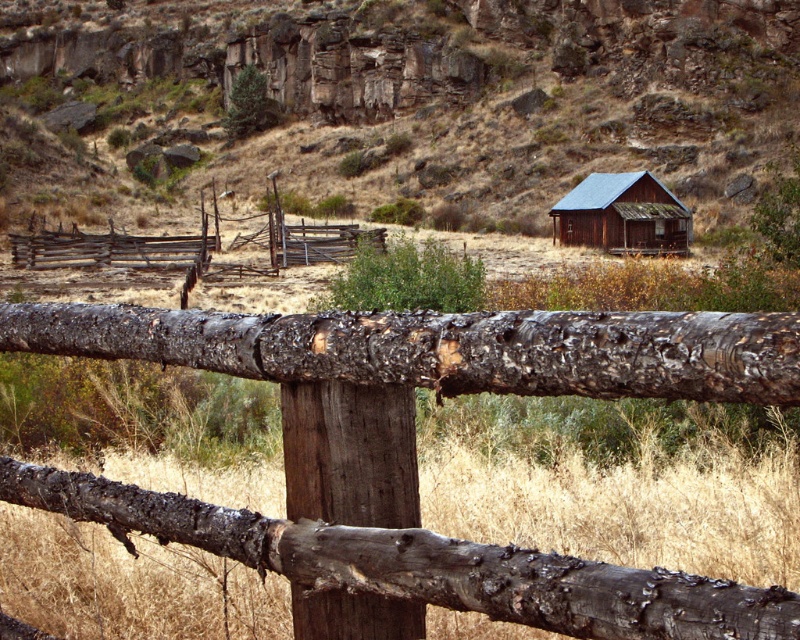
Between weathered wood fence at center and rusty wood cabin at center, which one has less height?

rusty wood cabin at center is shorter.

Between weathered wood fence at center and rusty wood cabin at center, which one is positioned higher?

rusty wood cabin at center is above.

Is point (150, 246) behind point (638, 198)?

No, it is not.

Find the location of a particular element. weathered wood fence at center is located at coordinates (194, 248).

Describe the element at coordinates (438, 96) in the screenshot. I see `brown wooden fence at center` at that location.

Is brown wooden fence at center above charred wood log at center?

Yes, brown wooden fence at center is above charred wood log at center.

Image resolution: width=800 pixels, height=640 pixels. I want to click on brown wooden fence at center, so click(x=438, y=96).

Locate an element on the screen. brown wooden fence at center is located at coordinates (438, 96).

Is charred wood log at center taller than weathered wood fence at center?

Incorrect, charred wood log at center's height is not larger of weathered wood fence at center's.

What do you see at coordinates (444, 348) in the screenshot?
I see `charred wood log at center` at bounding box center [444, 348].

Locate an element on the screen. The height and width of the screenshot is (640, 800). charred wood log at center is located at coordinates (444, 348).